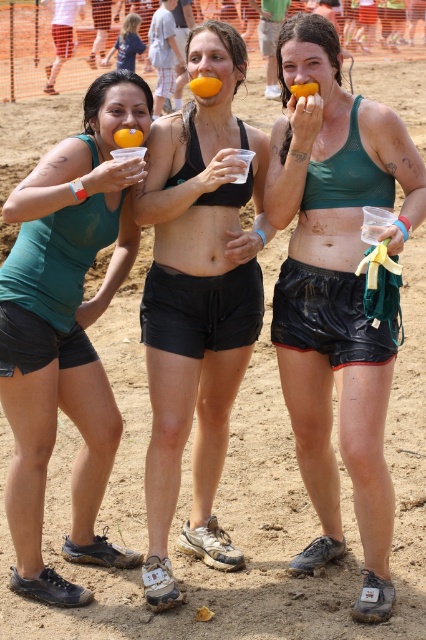
Between matte green tank top at center and orangesmoothorange at center, which one is positioned higher?

orangesmoothorange at center is above.

You are a GUI agent. You are given a task and a screenshot of the screen. Output one action in this format:
    pyautogui.click(x=<x>, y=<y>)
    Task: Click on the matte green tank top at center
    The image size is (426, 640).
    Given the screenshot: What is the action you would take?
    pyautogui.click(x=336, y=292)

Who is positioned more to the right, orange matte cup at center or orangesmoothorange at center?

orange matte cup at center

Image resolution: width=426 pixels, height=640 pixels. I want to click on orange matte cup at center, so click(x=204, y=84).

Who is lower down, black matte bikini top at center or black fabric shorts at center?

black matte bikini top at center

Can you confirm if black matte bikini top at center is thinner than black fabric shorts at center?

In fact, black matte bikini top at center might be wider than black fabric shorts at center.

Is point (233, 349) more distant than point (184, 305)?

Yes, point (233, 349) is behind point (184, 305).

You are a GUI agent. You are given a task and a screenshot of the screen. Output one action in this format:
    pyautogui.click(x=<x>, y=<y>)
    Task: Click on the black matte bikini top at center
    
    Given the screenshot: What is the action you would take?
    pyautogui.click(x=198, y=300)